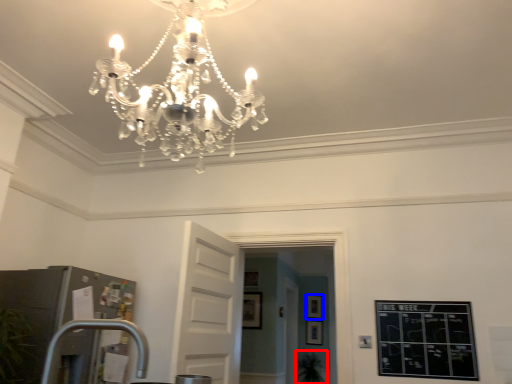
Question: Which point is further to the camera, plant (highlighted by a red box) or picture frame (highlighted by a blue box)?

Choices:
 (A) plant
 (B) picture frame

Answer: (B)